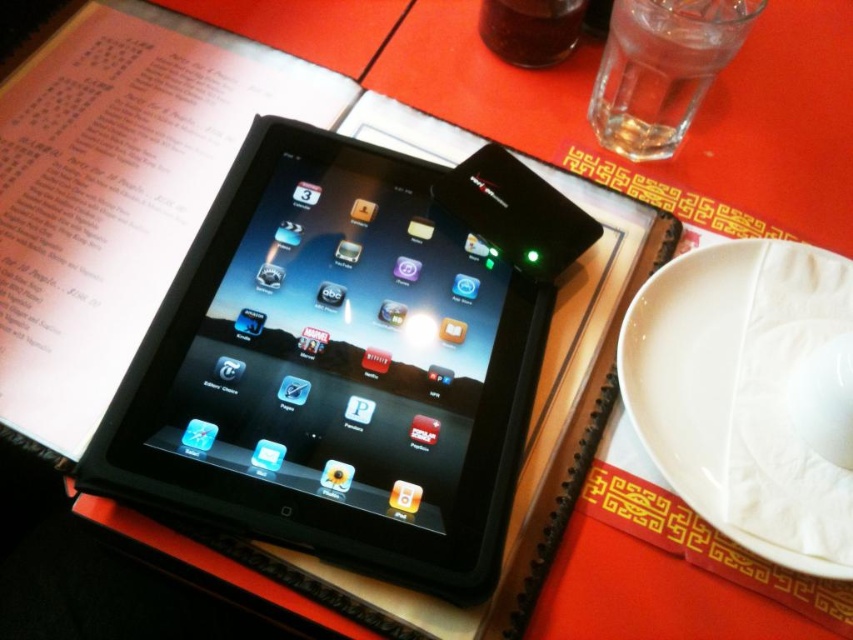
Between clear glass water at upper right and transparent glass at upper center, which one appears on the right side from the viewer's perspective?

From the viewer's perspective, clear glass water at upper right appears more on the right side.

Based on the photo, does clear glass water at upper right have a greater height compared to transparent glass at upper center?

Indeed, clear glass water at upper right has a greater height compared to transparent glass at upper center.

The height and width of the screenshot is (640, 853). What do you see at coordinates (660, 68) in the screenshot? I see `clear glass water at upper right` at bounding box center [660, 68].

This screenshot has height=640, width=853. In order to click on clear glass water at upper right in this screenshot , I will do `click(660, 68)`.

Is point (712, 298) positioned after point (494, 8)?

No, it is not.

At what (x,y) coordinates should I click in order to perform the action: click on white matte plate at lower right. Please return your answer as a coordinate pair (x, y). The width and height of the screenshot is (853, 640). Looking at the image, I should click on (741, 394).

Where is `white matte plate at lower right`? The width and height of the screenshot is (853, 640). white matte plate at lower right is located at coordinates (741, 394).

Is white matte plate at lower right wider than clear glass water at upper right?

Correct, the width of white matte plate at lower right exceeds that of clear glass water at upper right.

Who is lower down, white matte plate at lower right or clear glass water at upper right?

white matte plate at lower right is lower down.

Identify the location of white matte plate at lower right. Image resolution: width=853 pixels, height=640 pixels. (741, 394).

Locate an element on the screen. white matte plate at lower right is located at coordinates (741, 394).